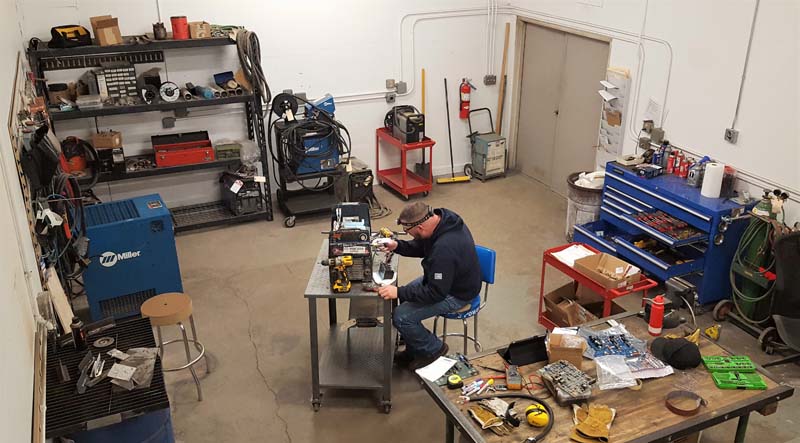
Locate an element on the screen. The height and width of the screenshot is (443, 800). stool is located at coordinates (189, 310).